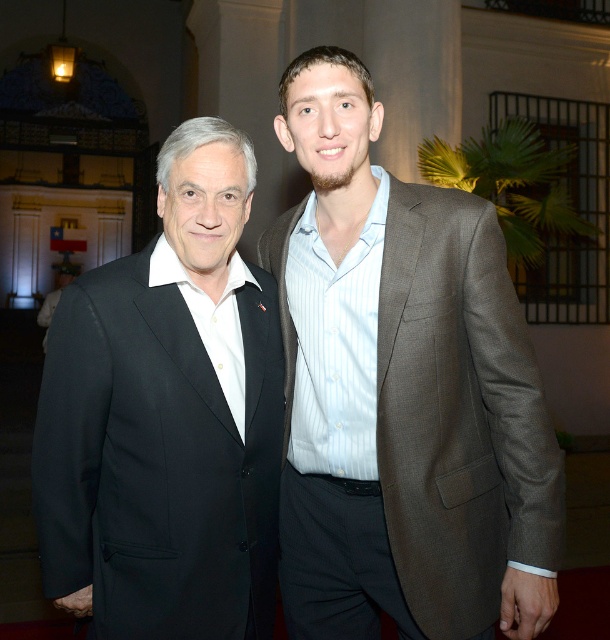
Can you confirm if brown textured suit at center is wider than black wool suit at left?

Correct, the width of brown textured suit at center exceeds that of black wool suit at left.

Which is behind, point (458, 417) or point (274, 364)?

Positioned behind is point (274, 364).

This screenshot has width=610, height=640. Identify the location of brown textured suit at center. (403, 392).

You are a GUI agent. You are given a task and a screenshot of the screen. Output one action in this format:
    pyautogui.click(x=<x>, y=<y>)
    Task: Click on the brown textured suit at center
    This screenshot has height=640, width=610.
    Given the screenshot: What is the action you would take?
    pyautogui.click(x=403, y=392)